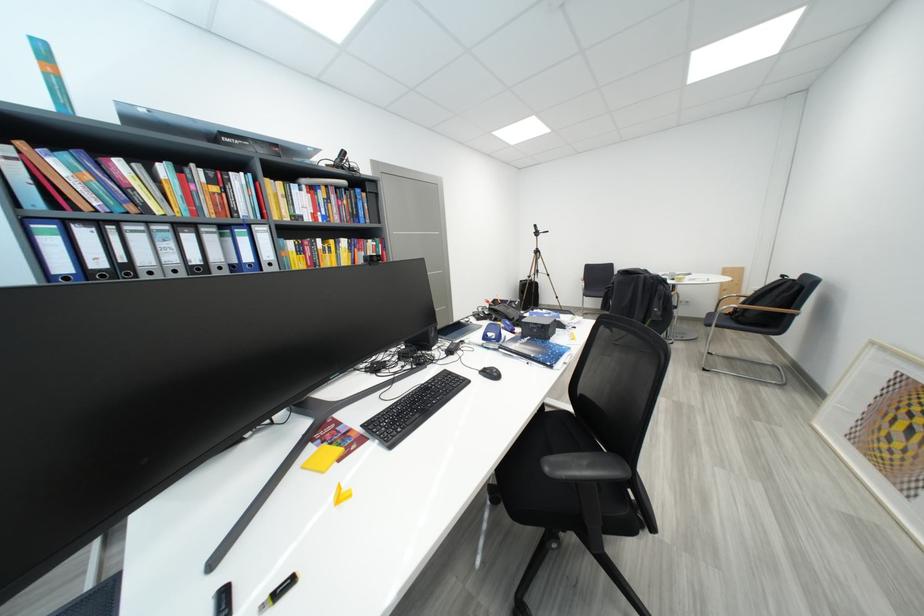
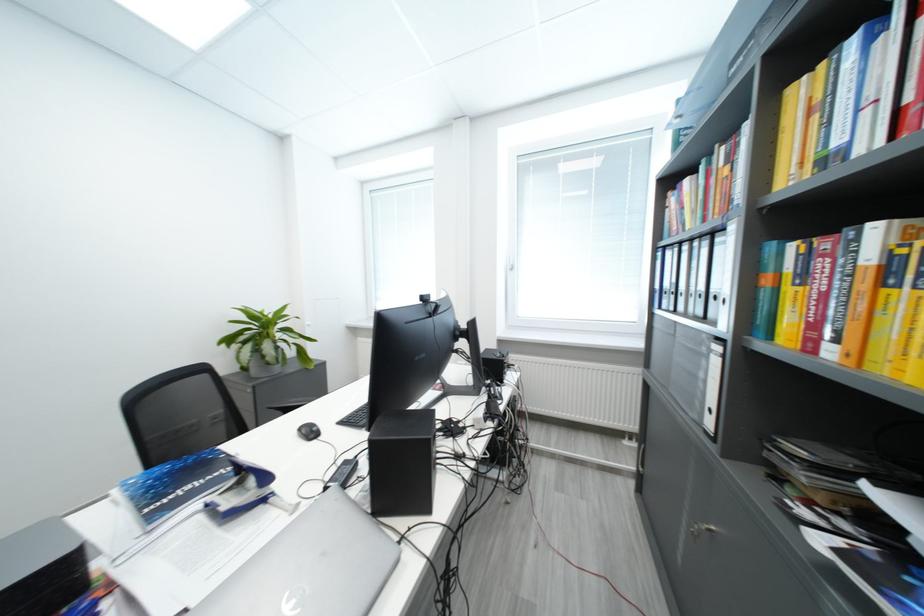
Locate, in the second image, the point that corresponds to [128,164] in the first image.

(696, 184)